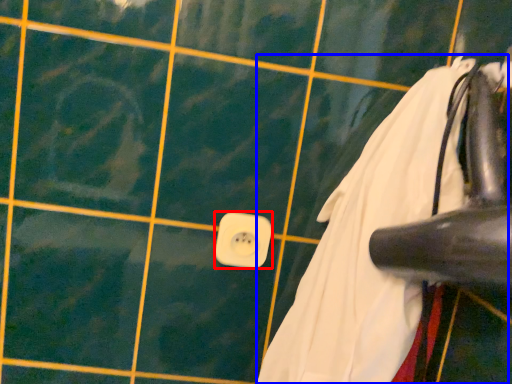
Question: Which object appears closest to the camera in this image, power plugs and sockets (highlighted by a red box) or laundry (highlighted by a blue box)?

Choices:
 (A) power plugs and sockets
 (B) laundry

Answer: (B)